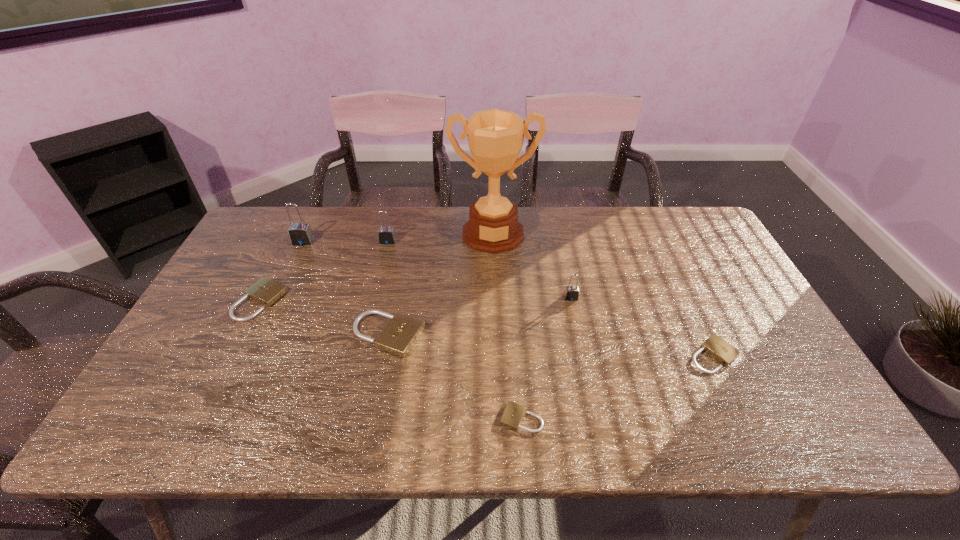
This screenshot has width=960, height=540. What are the coordinates of `free space located on the front of the fifth tallest padlock` in the screenshot? It's located at (214, 394).

At what (x,y) coordinates should I click in order to perform the action: click on vacant point located 0.380m on the left of the rightmost beige padlock. Please return your answer as a coordinate pair (x, y). This screenshot has width=960, height=540. Looking at the image, I should click on [537, 355].

The image size is (960, 540). Identify the location of vacant space located on the left of the smallest beige padlock. (441, 418).

This screenshot has width=960, height=540. I want to click on award present at the far edge, so click(x=495, y=137).

The height and width of the screenshot is (540, 960). Identify the location of object that is at the near edge. (513, 414).

I want to click on object at the right edge, so click(715, 346).

At what (x,y) coordinates should I click in order to perform the action: click on object located in the far left corner section of the desktop. Please return your answer as a coordinate pair (x, y). The width and height of the screenshot is (960, 540). Looking at the image, I should click on (300, 234).

The image size is (960, 540). I want to click on vacant region at the far edge, so click(x=397, y=244).

You are a GUI agent. You are given a task and a screenshot of the screen. Output one action in this format:
    pyautogui.click(x=<x>, y=<y>)
    Task: Click on the vacant region at the near edge of the desktop
    This screenshot has height=540, width=960.
    Given the screenshot: What is the action you would take?
    pyautogui.click(x=246, y=411)

In the image, there is a desktop. Identify the location of free space at the left edge. Image resolution: width=960 pixels, height=540 pixels. (238, 276).